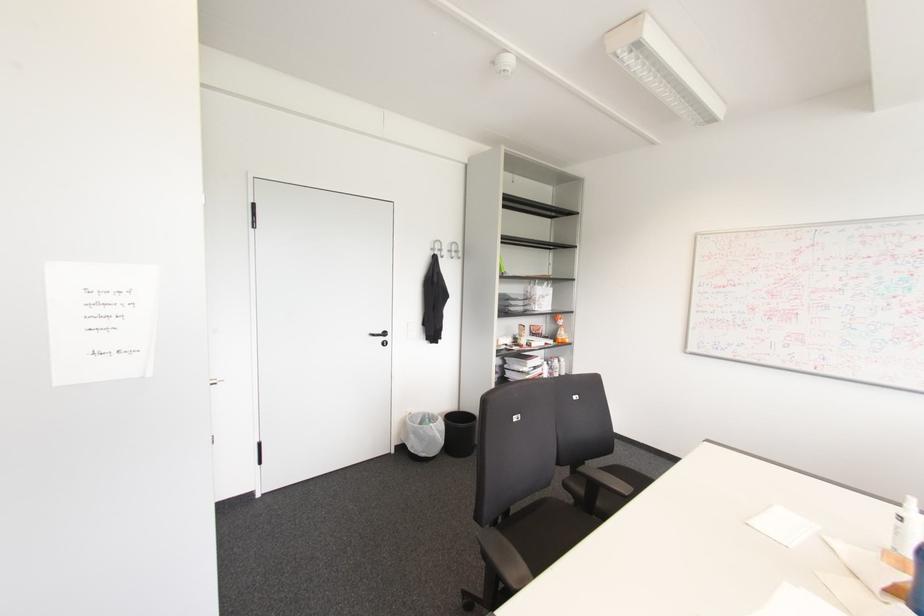
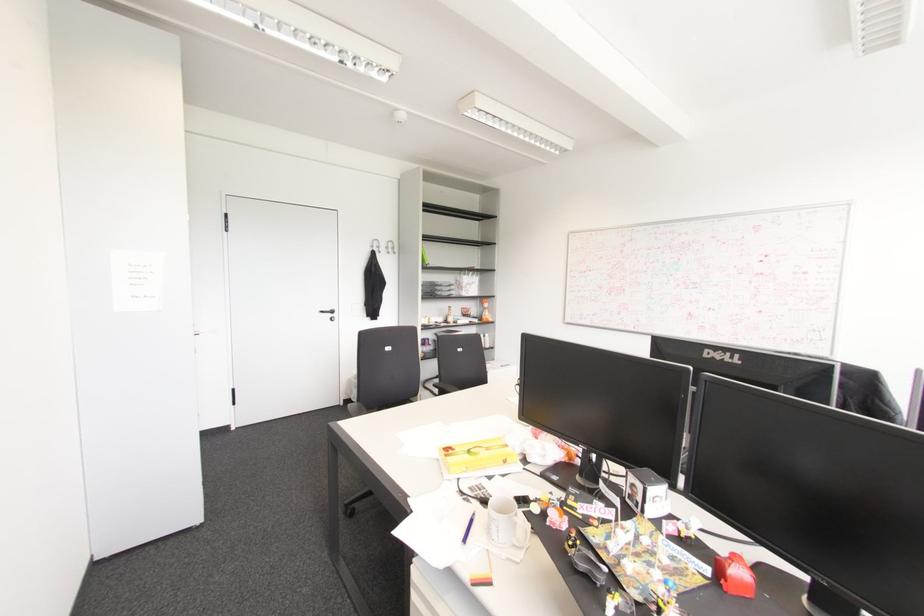
Where in the second image is the point corresponding to pixel 456 251 from the first image?

(392, 248)